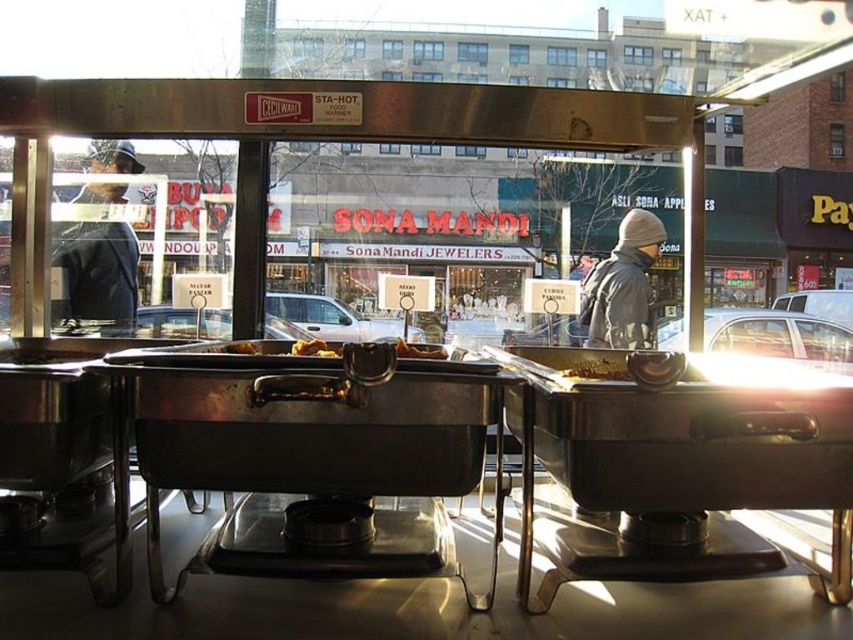
Question: Can you confirm if slightly browned bread at center is bigger than golden brown bread at center?

Choices:
 (A) yes
 (B) no

Answer: (A)

Question: Which object is farther from the camera taking this photo?

Choices:
 (A) brown matte food at center
 (B) slightly browned bread at center
 (C) golden brown bread at center

Answer: (C)

Question: Does yellow matte food at center come behind golden brown bread at center?

Choices:
 (A) yes
 (B) no

Answer: (B)

Question: Estimate the real-world distances between objects in this image. Which object is farther from the dark blue jacket at left?

Choices:
 (A) slightly browned bread at center
 (B) brown matte food at center

Answer: (B)

Question: Is brown matte food at center in front of golden brown bread at center?

Choices:
 (A) no
 (B) yes

Answer: (B)

Question: Which object appears closest to the camera in this image?

Choices:
 (A) gray woolen hat at upper center
 (B) slightly browned bread at center

Answer: (B)